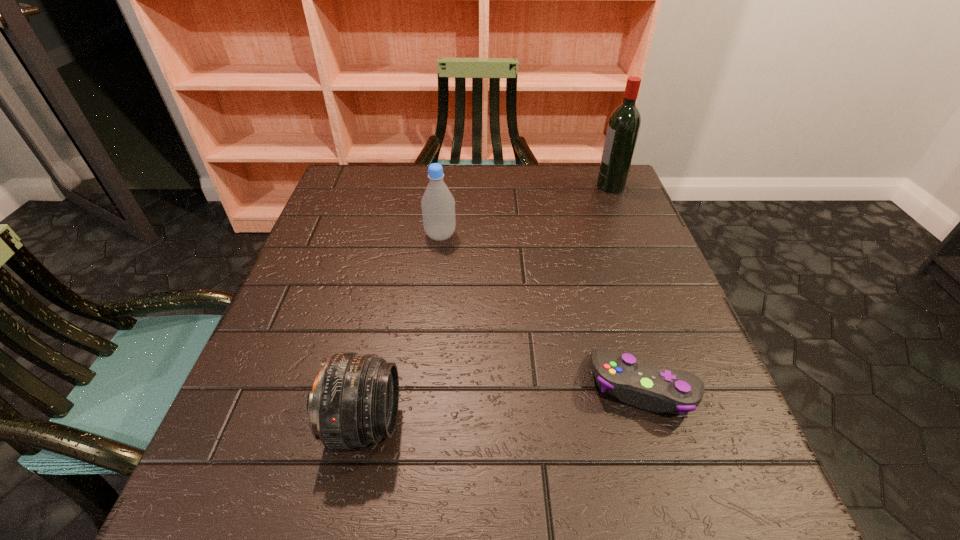
Where is `free point at the far right corner`? free point at the far right corner is located at coordinates (595, 183).

Locate an element on the screen. The image size is (960, 540). free region at the near right corner is located at coordinates (736, 497).

Identify the location of free point between the third tallest object and the wine bottle. The image size is (960, 540). (488, 305).

The height and width of the screenshot is (540, 960). Find the location of `free space between the telephoto lens and the shortest object`. free space between the telephoto lens and the shortest object is located at coordinates (505, 405).

Find the location of `free spot between the telephoto lens and the shortest object`. free spot between the telephoto lens and the shortest object is located at coordinates (505, 405).

Find the location of `free space between the second shortest object and the control`. free space between the second shortest object and the control is located at coordinates (505, 405).

Where is `free space between the shortest object and the second shortest object`? The image size is (960, 540). free space between the shortest object and the second shortest object is located at coordinates (505, 405).

Locate an element on the screen. The image size is (960, 540). vacant area that lies between the second tallest object and the shortest object is located at coordinates (542, 311).

This screenshot has height=540, width=960. Find the location of `free spot between the second farthest object and the tallest object`. free spot between the second farthest object and the tallest object is located at coordinates (525, 211).

Where is `free spot between the control and the second tallest object`? free spot between the control and the second tallest object is located at coordinates (542, 311).